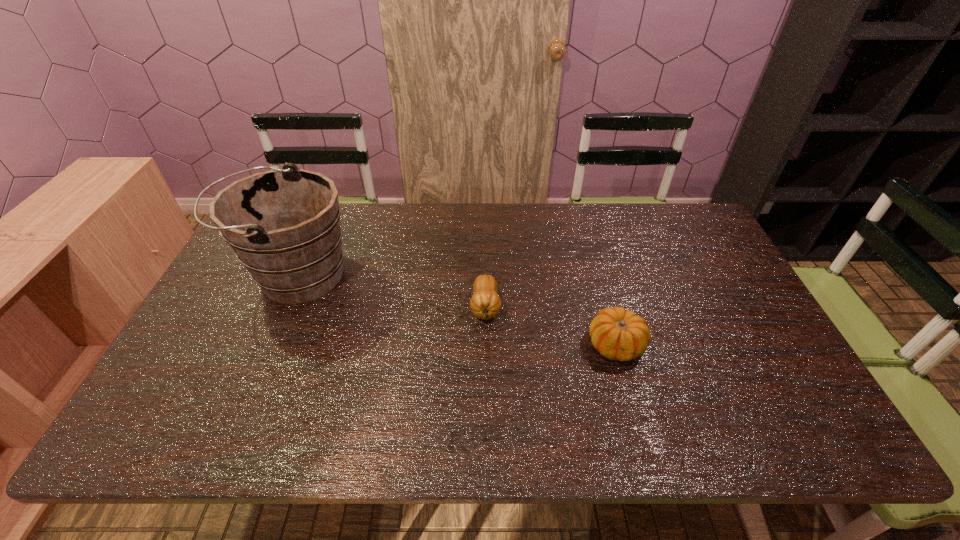
I want to click on bucket, so click(x=284, y=226).

At what (x,y) coordinates should I click in order to perform the action: click on the tallest object. Please return your answer as a coordinate pair (x, y). This screenshot has height=540, width=960. Looking at the image, I should click on (284, 226).

Where is `the rightmost object`? the rightmost object is located at coordinates (617, 334).

The height and width of the screenshot is (540, 960). Find the location of `the left gourd`. the left gourd is located at coordinates (485, 303).

Identify the location of free space located on the right of the right gourd. This screenshot has height=540, width=960. (767, 345).

At what (x,y) coordinates should I click in order to perform the action: click on vacant region located on the stem side of the left gourd. Please return your answer as a coordinate pair (x, y). Image resolution: width=960 pixels, height=540 pixels. Looking at the image, I should click on (487, 385).

I want to click on object present at the far edge, so click(x=284, y=226).

The width and height of the screenshot is (960, 540). I want to click on object situated at the left edge, so click(x=284, y=226).

I want to click on object that is at the far left corner, so click(284, 226).

In the image, there is a desktop. Where is `vacant space at the far edge`? This screenshot has width=960, height=540. vacant space at the far edge is located at coordinates (596, 226).